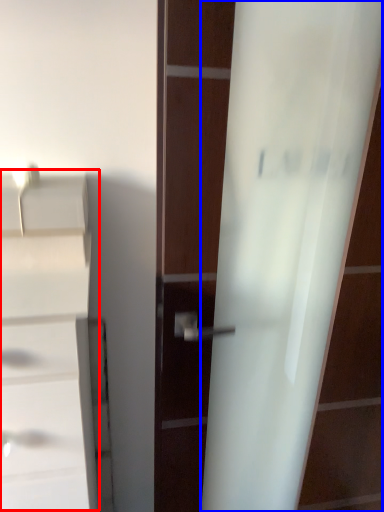
Question: Which object appears closest to the camera in this image, cabinetry (highlighted by a red box) or screen door (highlighted by a blue box)?

Choices:
 (A) cabinetry
 (B) screen door

Answer: (A)